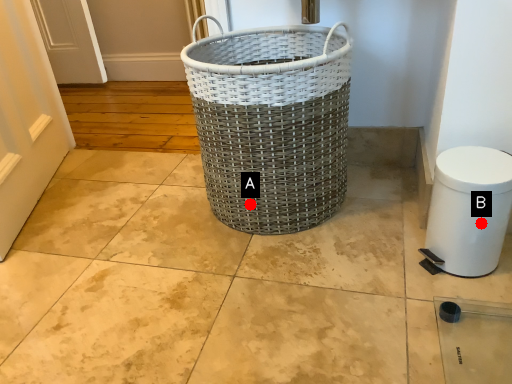
Question: Two points are circled on the image, labeled by A and B beside each circle. Which point is farther from the camera taking this photo?

Choices:
 (A) A is further
 (B) B is further

Answer: (A)